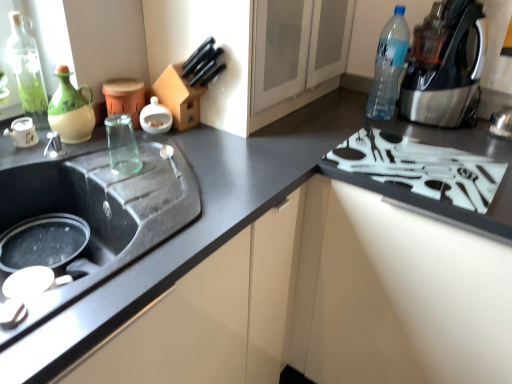
Where is `free point behind transparent glass cup at sink`? The image size is (512, 384). free point behind transparent glass cup at sink is located at coordinates (136, 148).